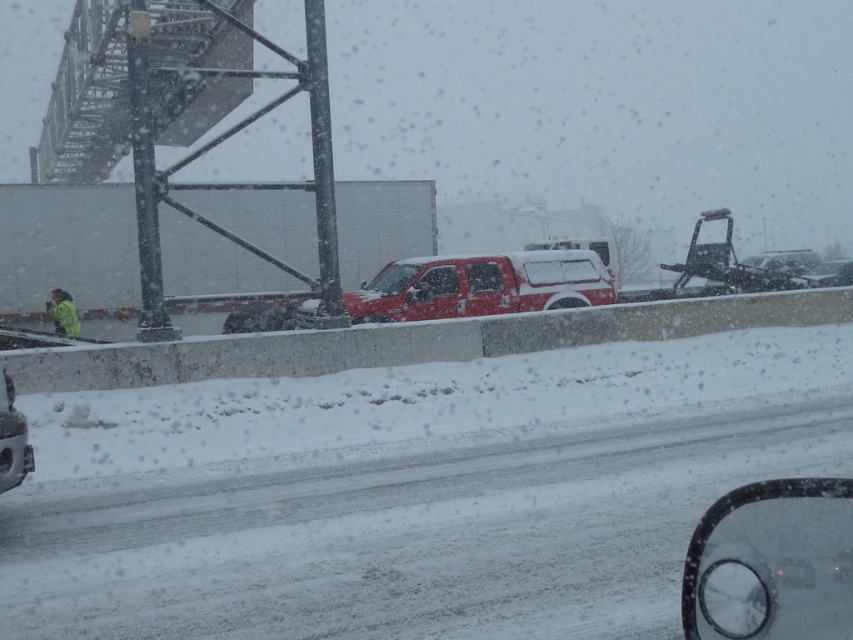
Locate an element on the screen. The image size is (853, 640). matte red pickup truck at center is located at coordinates (480, 285).

Looking at this image, who is lower down, matte red pickup truck at center or shiny black car at lower left?

Positioned lower is shiny black car at lower left.

Who is more distant from viewer, (585, 250) or (22, 474)?

Point (585, 250)

The height and width of the screenshot is (640, 853). What are the coordinates of `matte red pickup truck at center` in the screenshot? It's located at [480, 285].